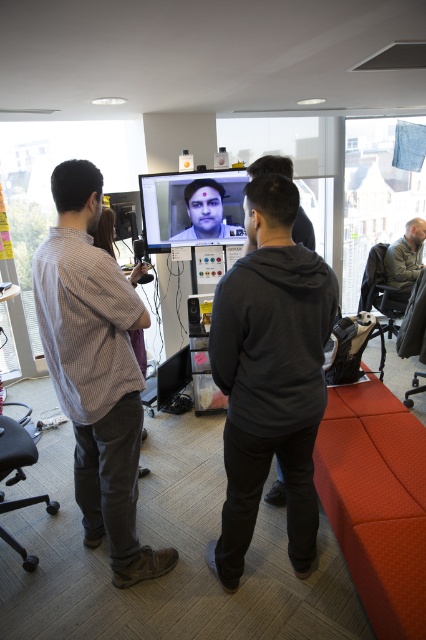
Question: Which point is farther from the camera taking this photo?

Choices:
 (A) (222, 580)
 (B) (423, 237)

Answer: (B)

Question: In this image, where is checkered fabric shirt at left located relative to matte black shirt at center?

Choices:
 (A) below
 (B) above

Answer: (A)

Question: Can you confirm if gray fabric jacket at right is wider than matte black shirt at center?

Choices:
 (A) yes
 (B) no

Answer: (A)

Question: Estimate the real-world distances between objects in this image. Which object is closer to the black leather swivel chair at lower left?

Choices:
 (A) gray fabric jacket at right
 (B) checkered fabric shirt at left

Answer: (B)

Question: Which of the following is the farthest from the observer?

Choices:
 (A) matte black face at center
 (B) black leather swivel chair at lower left

Answer: (A)

Question: Considering the relative positions of black leather swivel chair at lower left and matte black shirt at center in the image provided, where is black leather swivel chair at lower left located with respect to matte black shirt at center?

Choices:
 (A) left
 (B) right

Answer: (A)